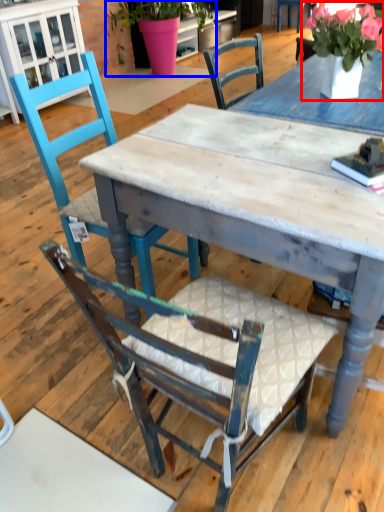
Question: Which object is further to the camera taking this photo, floral arrangement (highlighted by a red box) or houseplant (highlighted by a blue box)?

Choices:
 (A) floral arrangement
 (B) houseplant

Answer: (B)